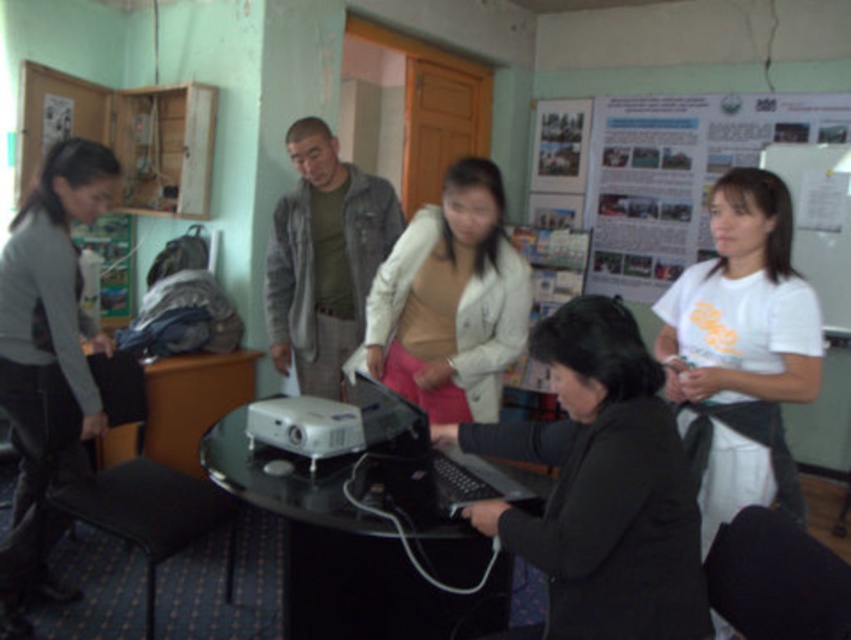
You are standing in the room and want to move from the gray sweater at left to the black glass table at center. Which direction should you move towards?

The black glass table at center is to the right of the gray sweater at left, so you should move towards the right to reach it.

You are organizing a meeting in this room and need to decide seating arrangements. Since there are only two chairs available, you want to seat the person wearing the white matte shirt at center and the person wearing the white textured jacket at center. Which of the two clothing items belongs to a taller individual?

The white matte shirt at center is larger in size compared to the white textured jacket at center, so the person wearing the white matte shirt at center is likely taller.